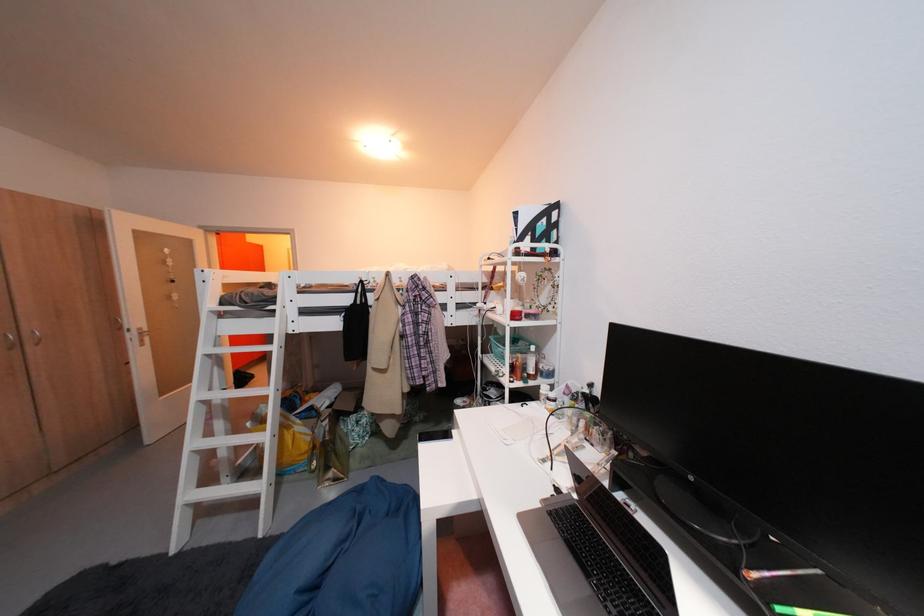
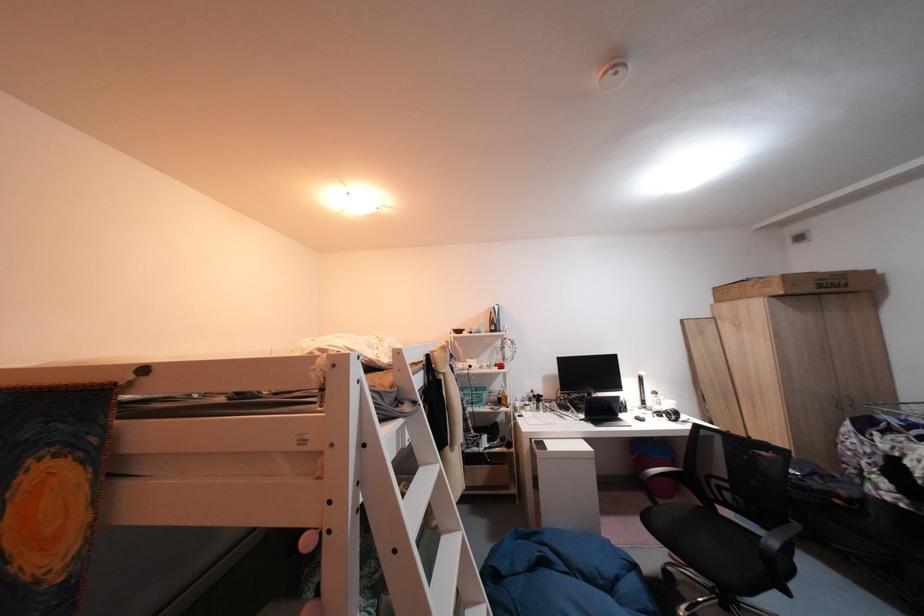
In the second image, find the point that corresponds to pixel 432 339 in the first image.

(475, 400)